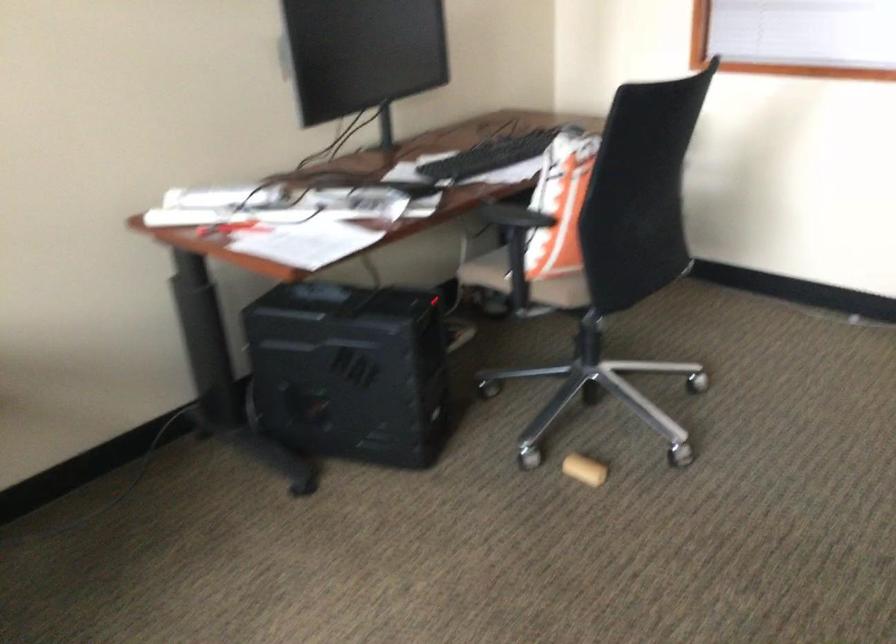
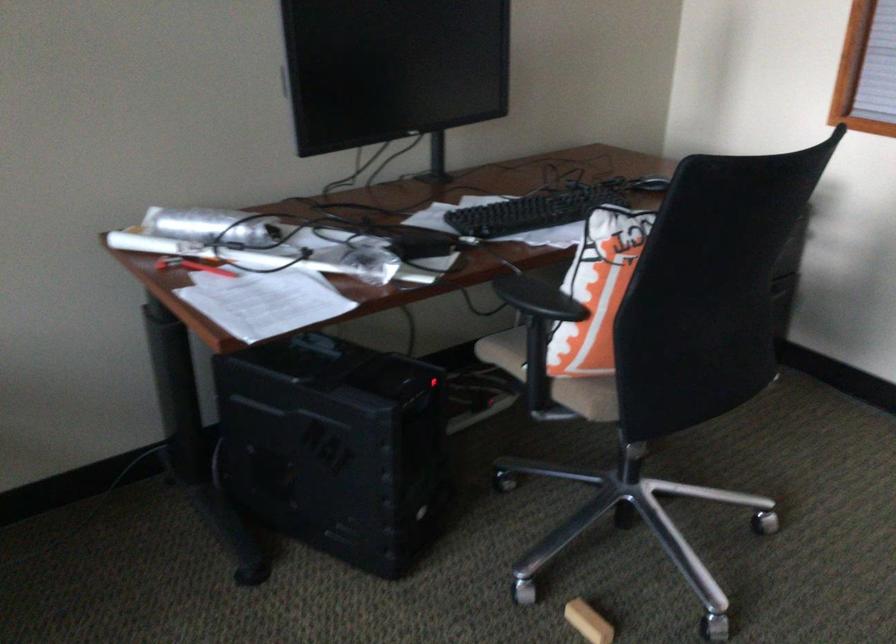
In the second image, find the point that corresponds to the point at 228,232 in the first image.

(192, 266)